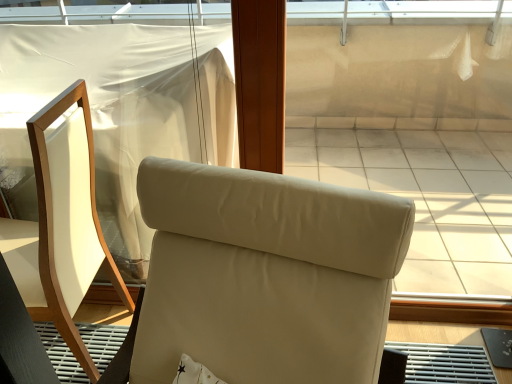
Question: In which direction should I rotate to look at beige leather chair at center, which is the second chair from left to right?

Choices:
 (A) right
 (B) left

Answer: (B)

Question: Is matte white chair at left, arranged as the first chair when viewed from the left, completely or partially inside beige leather chair at center, positioned as the 1th chair in right-to-left order?

Choices:
 (A) yes
 (B) no

Answer: (B)

Question: Is beige leather chair at center, which is the second chair from left to right, aimed at matte white chair at left, which is the 2th chair in right-to-left order?

Choices:
 (A) yes
 (B) no

Answer: (B)

Question: From the image's perspective, is beige leather chair at center, positioned as the 1th chair in right-to-left order, on matte white chair at left, which is the 2th chair in right-to-left order?

Choices:
 (A) no
 (B) yes

Answer: (A)

Question: Are beige leather chair at center, positioned as the 1th chair in right-to-left order, and matte white chair at left, arranged as the first chair when viewed from the left, located far from each other?

Choices:
 (A) yes
 (B) no

Answer: (B)

Question: From a real-world perspective, is beige leather chair at center, positioned as the 1th chair in right-to-left order, below matte white chair at left, arranged as the first chair when viewed from the left?

Choices:
 (A) yes
 (B) no

Answer: (A)

Question: From a real-world perspective, is beige leather chair at center, which is the second chair from left to right, positioned over matte white chair at left, arranged as the first chair when viewed from the left, based on gravity?

Choices:
 (A) no
 (B) yes

Answer: (A)

Question: From the image's perspective, is matte white chair at left, which is the 2th chair in right-to-left order, on beige leather chair at center, which is the second chair from left to right?

Choices:
 (A) yes
 (B) no

Answer: (A)

Question: Can you confirm if matte white chair at left, arranged as the first chair when viewed from the left, is taller than beige leather chair at center, which is the second chair from left to right?

Choices:
 (A) yes
 (B) no

Answer: (B)

Question: Is matte white chair at left, arranged as the first chair when viewed from the left, closer to the viewer compared to beige leather chair at center, positioned as the 1th chair in right-to-left order?

Choices:
 (A) yes
 (B) no

Answer: (B)

Question: From a real-world perspective, is matte white chair at left, arranged as the first chair when viewed from the left, located higher than beige leather chair at center, positioned as the 1th chair in right-to-left order?

Choices:
 (A) yes
 (B) no

Answer: (A)

Question: Is beige leather chair at center, which is the second chair from left to right, completely or partially inside matte white chair at left, which is the 2th chair in right-to-left order?

Choices:
 (A) yes
 (B) no

Answer: (B)

Question: Does matte white chair at left, which is the 2th chair in right-to-left order, have a smaller size compared to beige leather chair at center, positioned as the 1th chair in right-to-left order?

Choices:
 (A) no
 (B) yes

Answer: (B)

Question: From the image's perspective, is beige leather chair at center, which is the second chair from left to right, located above or below matte white chair at left, which is the 2th chair in right-to-left order?

Choices:
 (A) above
 (B) below

Answer: (B)